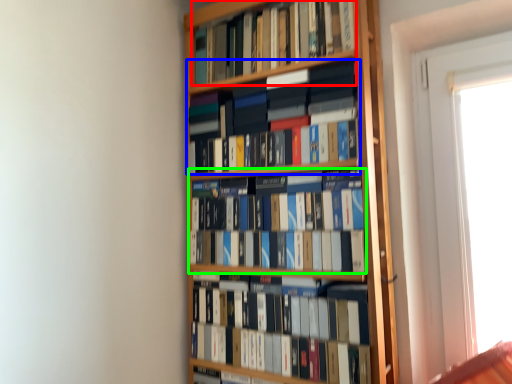
Question: Based on their relative distances, which object is farther from book (highlighted by a red box)? Choose from book (highlighted by a blue box) and book (highlighted by a green box).

Choices:
 (A) book
 (B) book

Answer: (B)